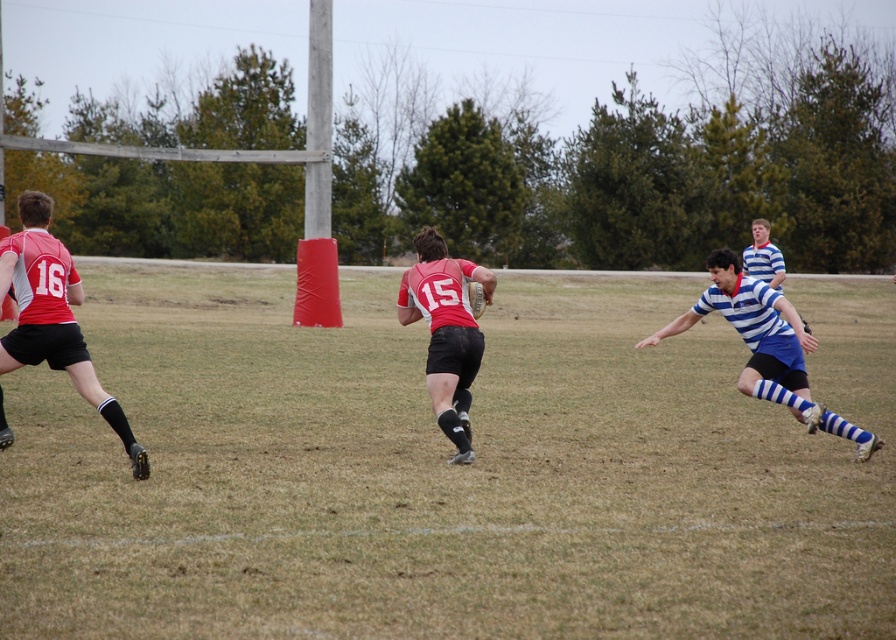
Does green grass at center have a smaller size compared to matte red jersey at center?

No, green grass at center is not smaller than matte red jersey at center.

Between green grass at center and matte red jersey at center, which one has less height?

matte red jersey at center is shorter.

Is point (643, 385) positioned after point (468, 304)?

That is True.

The image size is (896, 640). I want to click on green grass at center, so click(x=445, y=468).

Between blue striped jersey at right and matte red jersey at center, which one is positioned lower?

blue striped jersey at right

Who is positioned more to the right, blue striped jersey at right or matte red jersey at center?

blue striped jersey at right is more to the right.

Between point (725, 300) and point (475, 348), which one is positioned behind?

The point (725, 300) is behind.

Locate an element on the screen. This screenshot has height=640, width=896. blue striped jersey at right is located at coordinates (765, 346).

Locate an element on the screen. green grass at center is located at coordinates (445, 468).

Who is more distant from viewer, (293, 352) or (773, 326)?

Point (293, 352)

Image resolution: width=896 pixels, height=640 pixels. Identify the location of green grass at center. (445, 468).

This screenshot has width=896, height=640. What are the coordinates of `green grass at center` in the screenshot? It's located at (445, 468).